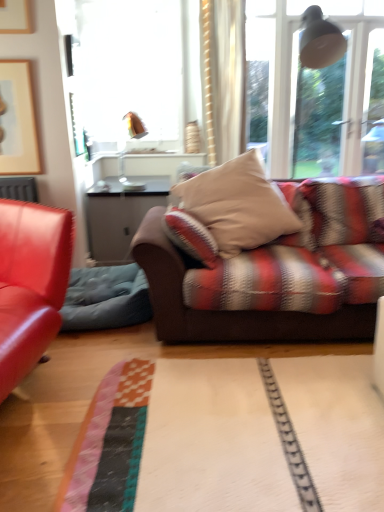
Question: Can you confirm if beige fabric pillow at center is shorter than velvet blue swivel chair at left?

Choices:
 (A) yes
 (B) no

Answer: (B)

Question: Is beige fabric pillow at center looking in the opposite direction of velvet blue swivel chair at left?

Choices:
 (A) yes
 (B) no

Answer: (B)

Question: Can you confirm if beige fabric pillow at center is smaller than velvet blue swivel chair at left?

Choices:
 (A) no
 (B) yes

Answer: (A)

Question: Can you confirm if beige fabric pillow at center is thinner than velvet blue swivel chair at left?

Choices:
 (A) yes
 (B) no

Answer: (A)

Question: Can you confirm if beige fabric pillow at center is taller than velvet blue swivel chair at left?

Choices:
 (A) no
 (B) yes

Answer: (B)

Question: Considering their positions, is copper metallic lamp at upper center located in front of or behind velvet blue swivel chair at left?

Choices:
 (A) front
 (B) behind

Answer: (B)

Question: From the image's perspective, is copper metallic lamp at upper center located above or below velvet blue swivel chair at left?

Choices:
 (A) below
 (B) above

Answer: (B)

Question: Is copper metallic lamp at upper center inside the boundaries of velvet blue swivel chair at left, or outside?

Choices:
 (A) inside
 (B) outside

Answer: (B)

Question: Is copper metallic lamp at upper center wider or thinner than velvet blue swivel chair at left?

Choices:
 (A) thin
 (B) wide

Answer: (A)

Question: Considering their positions, is matte wooden picture frame at upper left located in front of or behind transparent glass window at upper center?

Choices:
 (A) front
 (B) behind

Answer: (B)

Question: From the image's perspective, relative to transparent glass window at upper center, is matte wooden picture frame at upper left above or below?

Choices:
 (A) above
 (B) below

Answer: (A)

Question: Considering the relative positions of matte wooden picture frame at upper left and transparent glass window at upper center in the image provided, is matte wooden picture frame at upper left to the left or to the right of transparent glass window at upper center?

Choices:
 (A) right
 (B) left

Answer: (B)

Question: Considering the positions of matte wooden picture frame at upper left and transparent glass window at upper center in the image, is matte wooden picture frame at upper left wider or thinner than transparent glass window at upper center?

Choices:
 (A) wide
 (B) thin

Answer: (B)

Question: Looking at their shapes, would you say matte wooden picture frame at upper left is wider or thinner than velvet blue swivel chair at left?

Choices:
 (A) wide
 (B) thin

Answer: (B)

Question: From the image's perspective, is matte wooden picture frame at upper left positioned above or below velvet blue swivel chair at left?

Choices:
 (A) below
 (B) above

Answer: (B)